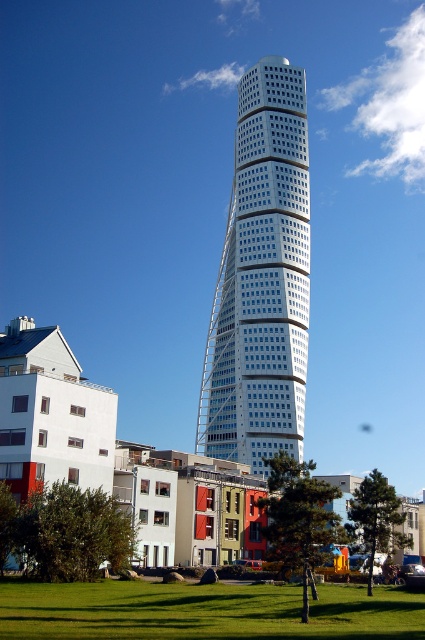
Question: Which point is closer to the camera?

Choices:
 (A) white glass skyscraper at center
 (B) green grass at lower center

Answer: (B)

Question: From the image, what is the correct spatial relationship of white glass skyscraper at center in relation to green grass at lower center?

Choices:
 (A) left
 (B) right

Answer: (B)

Question: Is the position of white glass skyscraper at center less distant than that of green grass at lower center?

Choices:
 (A) yes
 (B) no

Answer: (B)

Question: From the image, what is the correct spatial relationship of white glass skyscraper at center in relation to green grass at lower center?

Choices:
 (A) above
 (B) below

Answer: (A)